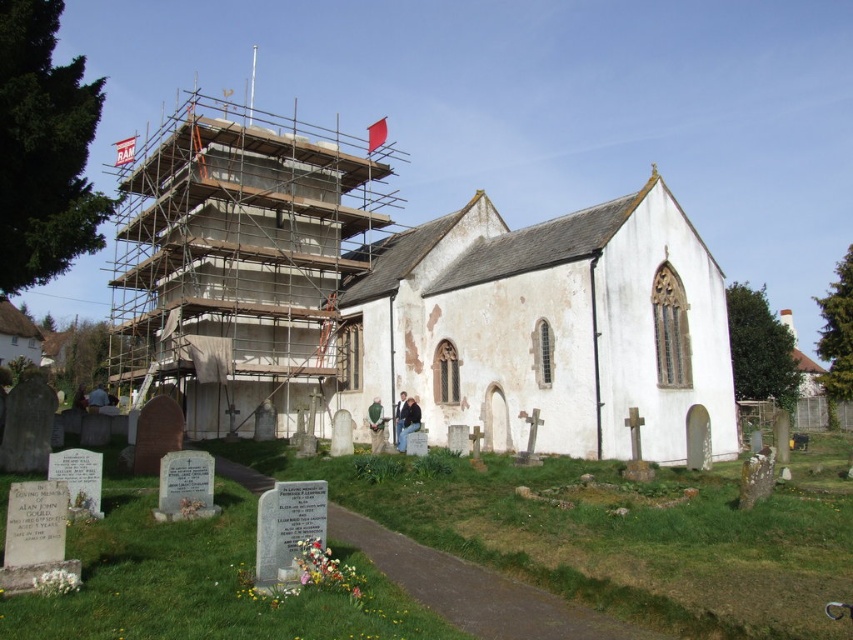
Question: Which of the following is the closest to the observer?

Choices:
 (A) (306, 301)
 (B) (640, 410)

Answer: (B)

Question: Observing the image, what is the correct spatial positioning of white stone chapel at center in reference to concrete scaffolding at center?

Choices:
 (A) left
 (B) right

Answer: (B)

Question: Is white stone chapel at center further to the viewer compared to concrete scaffolding at center?

Choices:
 (A) no
 (B) yes

Answer: (A)

Question: Which object appears closest to the camera in this image?

Choices:
 (A) white stone chapel at center
 (B) concrete scaffolding at center

Answer: (A)

Question: Can you confirm if white stone chapel at center is smaller than concrete scaffolding at center?

Choices:
 (A) no
 (B) yes

Answer: (B)